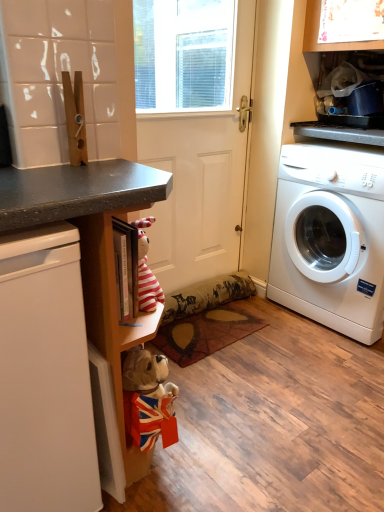
Where is `vacant area situated to the left side of white plastic washing machine at right`? Image resolution: width=384 pixels, height=512 pixels. vacant area situated to the left side of white plastic washing machine at right is located at coordinates (264, 334).